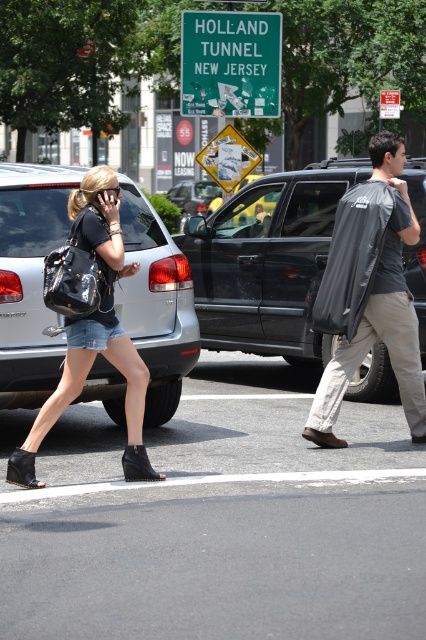
You are a pedestrian standing at the point marked by the coordinates point [267,260]. You want to cross the street to the other side. Which direction should you walk to avoid the matte black suv at center?

The point [267,260] is on the matte black suv at center, so you should walk in any direction away from the matte black suv at center to reach the other side of the street safely.

You are a delivery person who needs to load a tall package into your vehicle. You see the matte black suv at center and the green matte sign at upper center. Which object is taller so that you can determine if your package will fit inside the suv?

The matte black suv at center is taller than the green matte sign at upper center, so the package may fit inside the suv if its height is less than or equal to the suv.